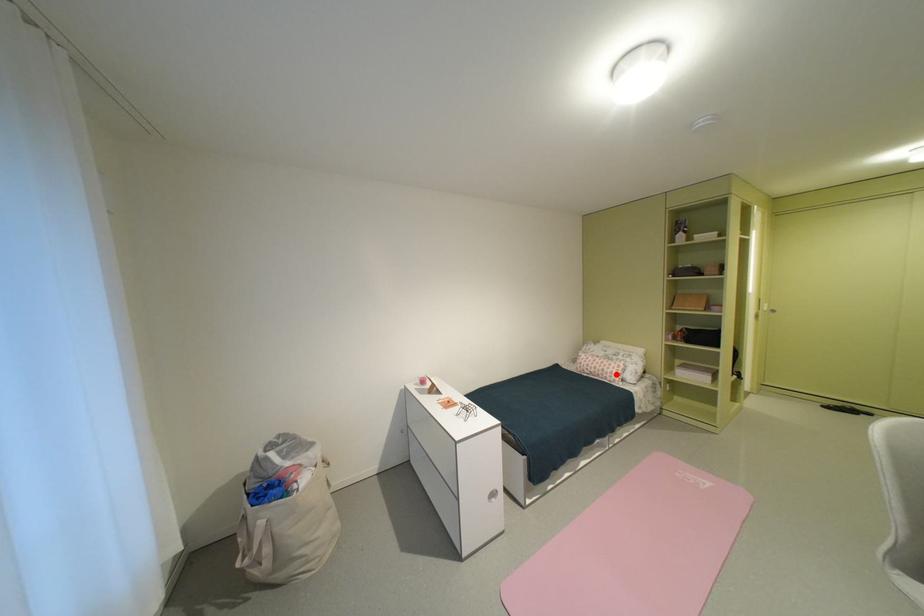
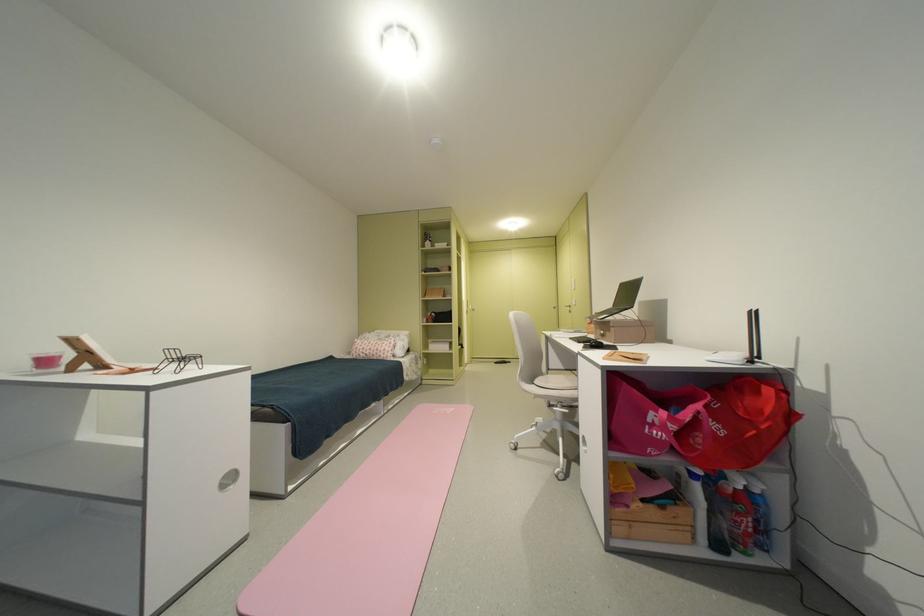
Find the pixel in the second image that matches the highlighted location in the first image.

(390, 352)